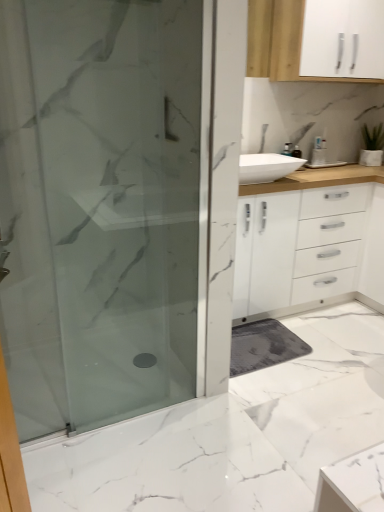
Where is `vacant area that lies in front of frosted glass shower door at left`? The width and height of the screenshot is (384, 512). vacant area that lies in front of frosted glass shower door at left is located at coordinates [x=120, y=461].